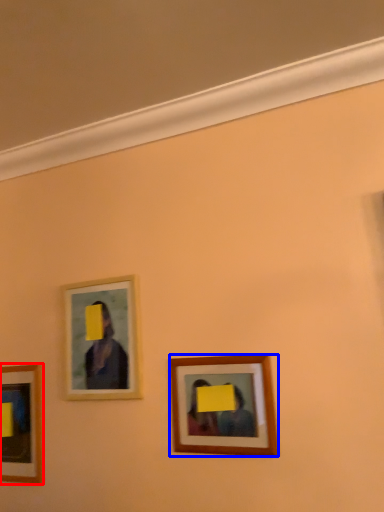
Question: Which point is closer to the camera, picture frame (highlighted by a red box) or picture frame (highlighted by a blue box)?

Choices:
 (A) picture frame
 (B) picture frame

Answer: (B)